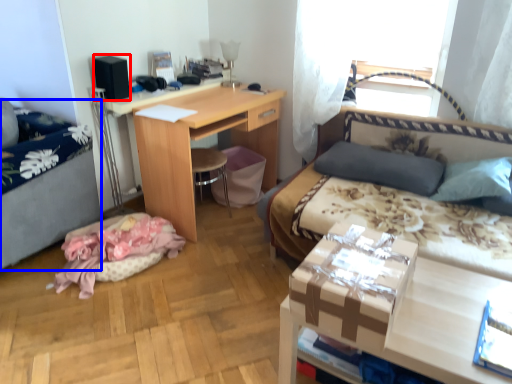
Question: Which object is further to the camera taking this photo, box (highlighted by a red box) or hospital bed (highlighted by a blue box)?

Choices:
 (A) box
 (B) hospital bed

Answer: (A)